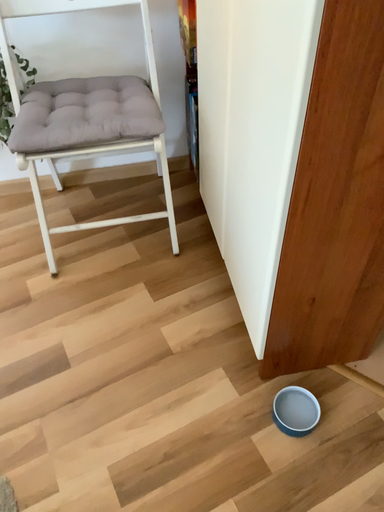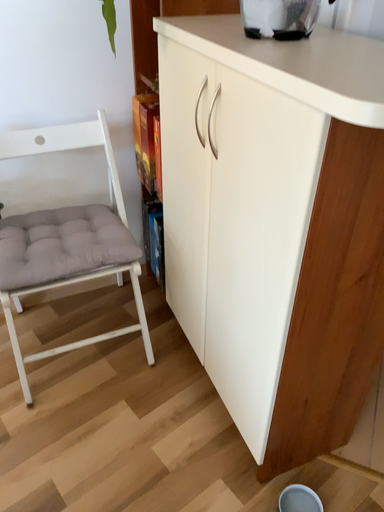
Question: How did the camera likely rotate when shooting the video?

Choices:
 (A) rotated upward
 (B) rotated downward

Answer: (A)